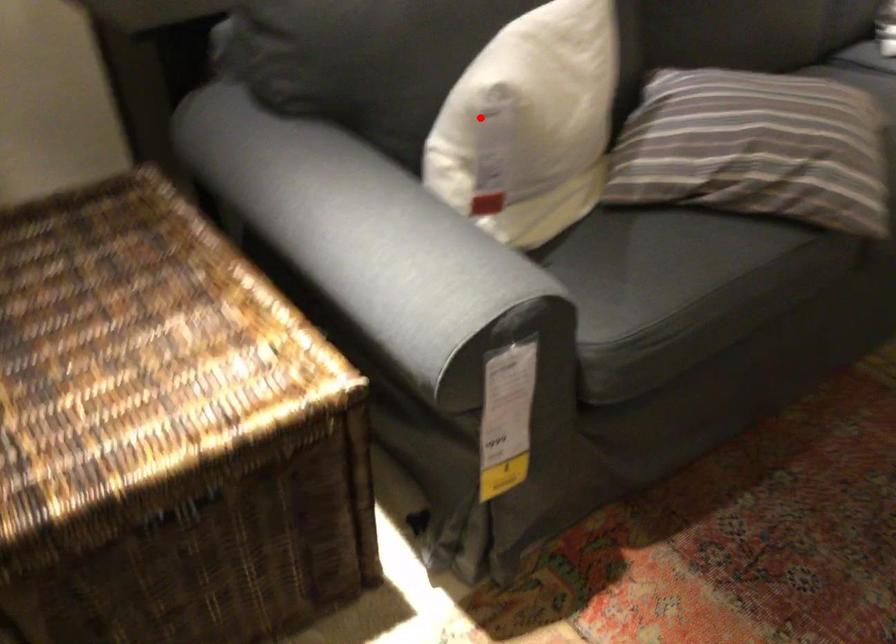
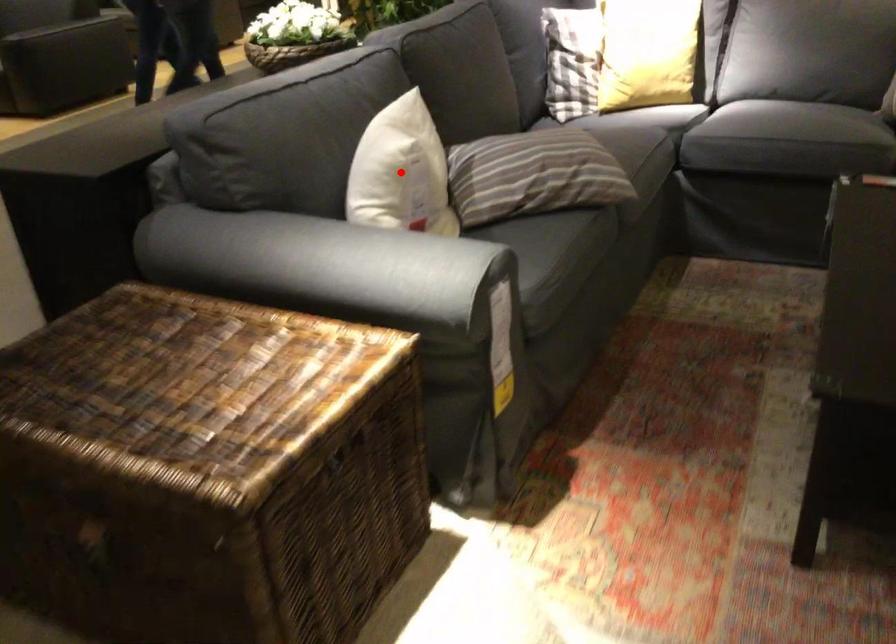
I am providing you with two images of the same scene from different viewpoints. A red point is marked on the first image and another point is marked on the second image. Are the points marked in image1 and image2 representing the same 3D position?

Yes